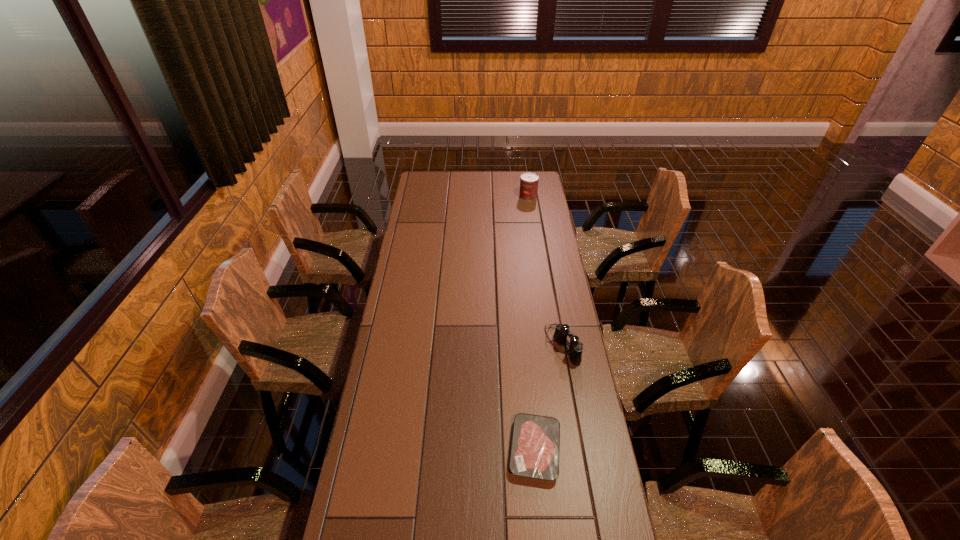
Identify the location of free spot between the binoculars and the can. The width and height of the screenshot is (960, 540). (545, 271).

Where is `empty space between the tallest object and the shortest object`? The image size is (960, 540). empty space between the tallest object and the shortest object is located at coordinates (532, 323).

Locate an element on the screen. The height and width of the screenshot is (540, 960). vacant space that's between the shortest object and the binoculars is located at coordinates (548, 397).

This screenshot has width=960, height=540. I want to click on vacant area that lies between the shortest object and the binoculars, so click(x=548, y=397).

The width and height of the screenshot is (960, 540). I want to click on object that is the closest to the can, so click(562, 331).

Locate an element on the screen. The image size is (960, 540). the closest object relative to the farthest object is located at coordinates (562, 331).